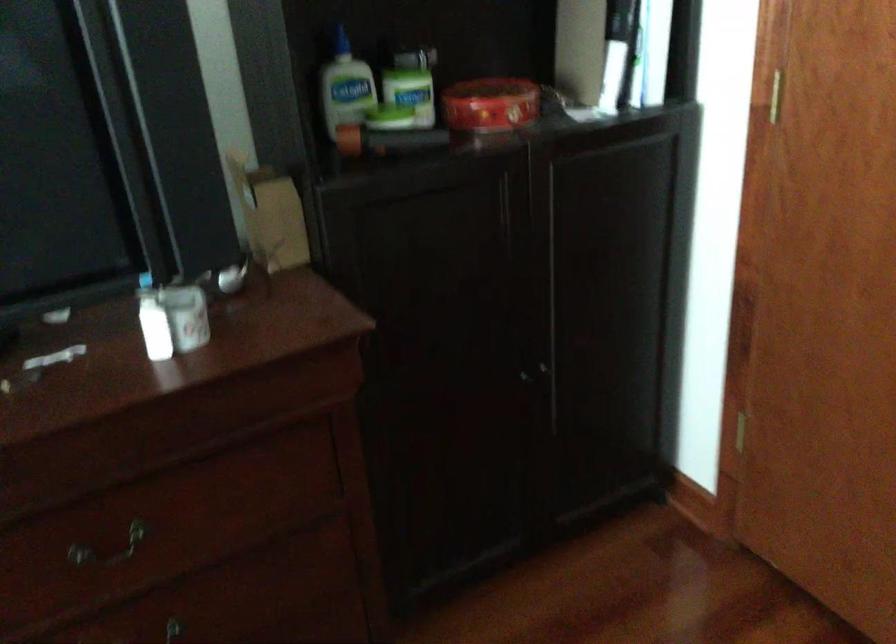
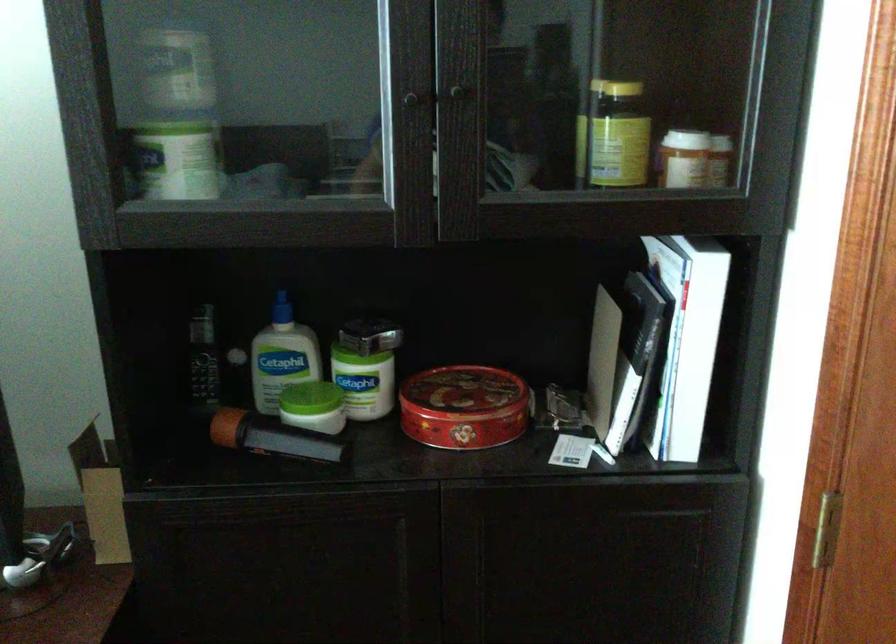
Find the pixel in the second image that matches point (289, 93) in the first image.

(202, 357)